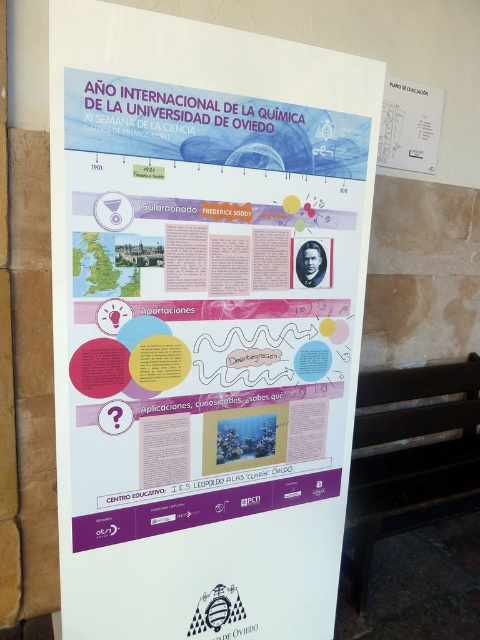
You are holding a camera and want to take a photo of the white paper poster at center. The camera requires a minimum distance of 1.2 meters to focus properly. Will you be able to take a clear photo from your current position?

The distance between you and the white paper poster at center is 1.18 meters, which is less than the required 1.2 meters for the camera to focus properly. Therefore, you will not be able to take a clear photo from your current position.

You are standing in front of the white paper poster at center and want to sit down. Is the black wood park bench at lower right located below the poster?

Yes, the white paper poster at center is located above the black wood park bench at lower right, so the bench is indeed below the poster.